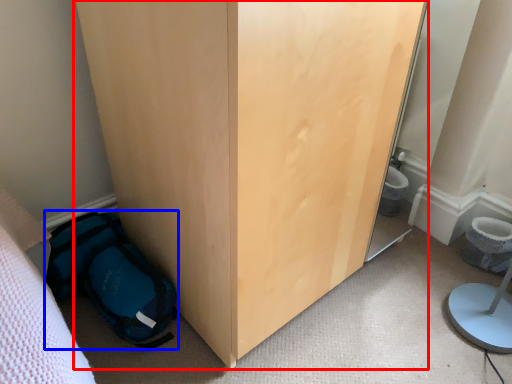
Question: Which object appears closest to the camera in this image, furniture (highlighted by a red box) or backpack (highlighted by a blue box)?

Choices:
 (A) furniture
 (B) backpack

Answer: (A)